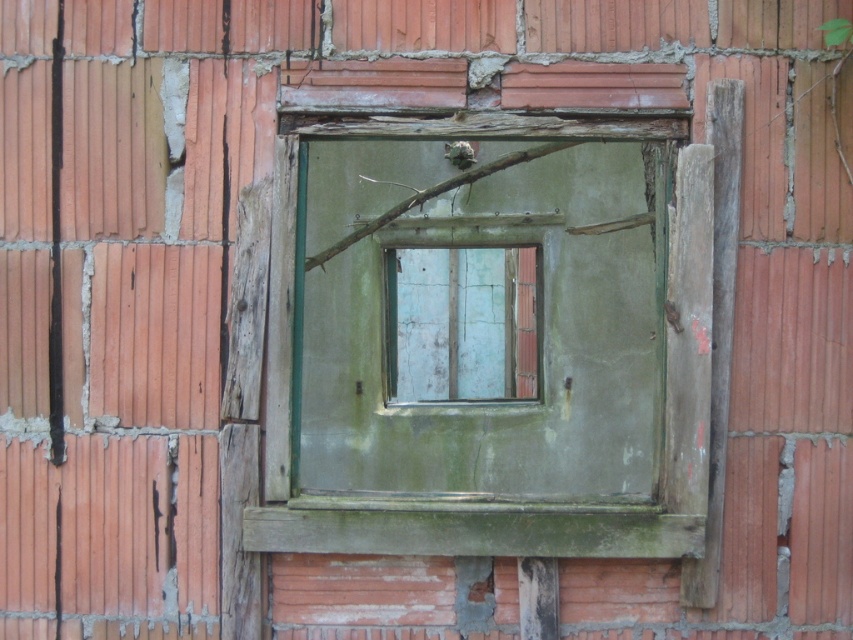
From the picture: Is green weathered wood at center bigger than peeling paint window at center?

Yes, green weathered wood at center is bigger than peeling paint window at center.

Is point (427, 536) closer to viewer compared to point (485, 282)?

Yes, point (427, 536) is in front of point (485, 282).

Describe the element at coordinates (489, 349) in the screenshot. I see `green weathered wood at center` at that location.

At what (x,y) coordinates should I click in order to perform the action: click on green weathered wood at center. Please return your answer as a coordinate pair (x, y). Image resolution: width=853 pixels, height=640 pixels. Looking at the image, I should click on coord(489,349).